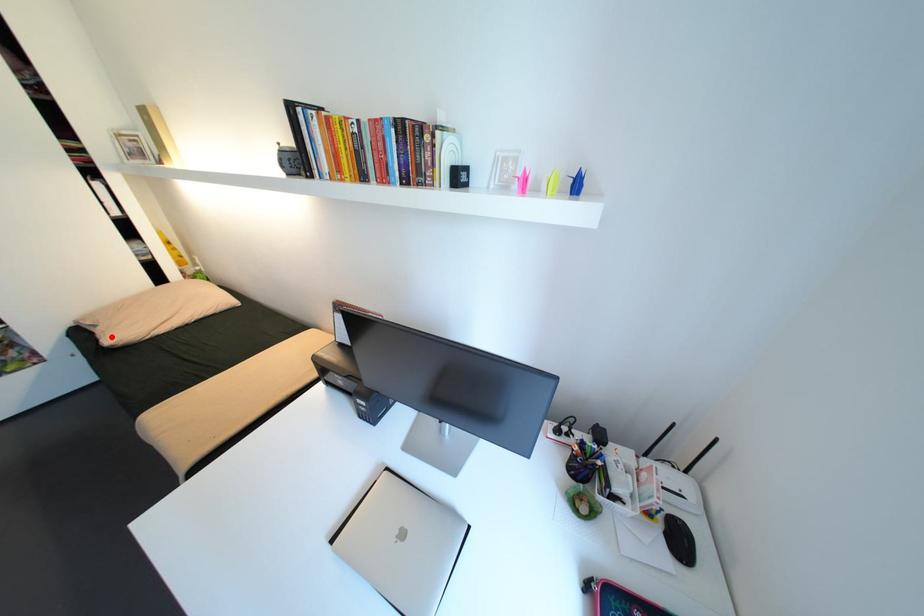
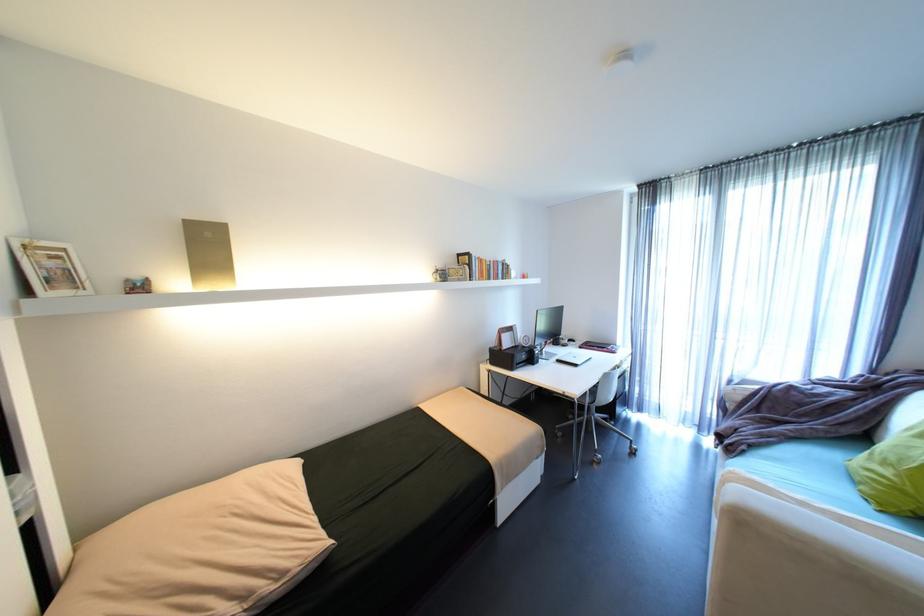
Question: I am providing you with two images of the same scene from different viewpoints. Image1 has a red point marked. In image2, the corresponding 3D location appears at what relative position? Reply with the corresponding letter.

Choices:
 (A) Closer
 (B) Farther

Answer: (B)